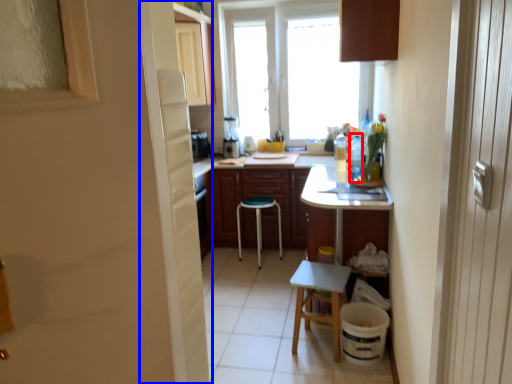
Question: Which point is closer to the camera, bottle (highlighted by a red box) or screen door (highlighted by a blue box)?

Choices:
 (A) bottle
 (B) screen door

Answer: (B)